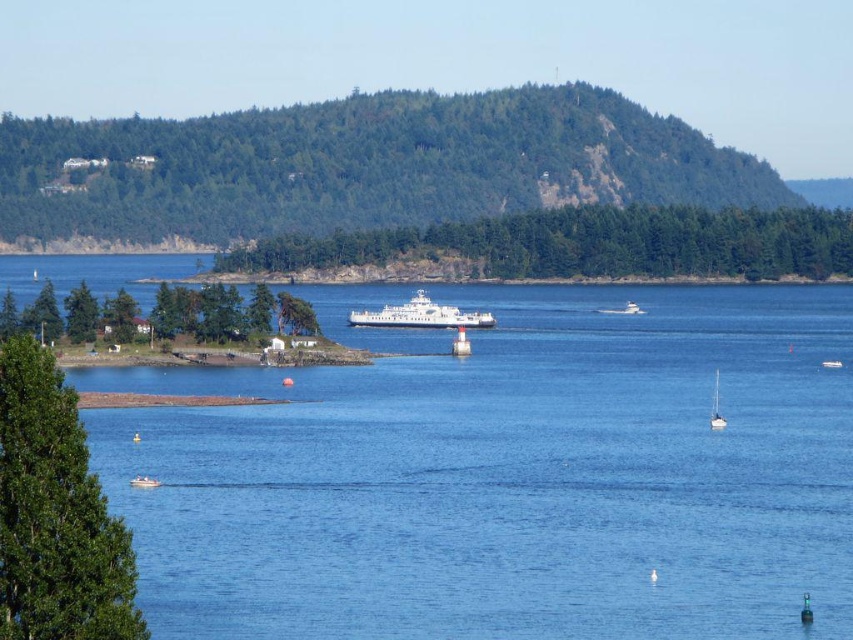
Question: Does white glossy ferry at center have a lesser width compared to white glossy sailboat at lower right?

Choices:
 (A) no
 (B) yes

Answer: (A)

Question: Among these objects, which one is farthest from the camera?

Choices:
 (A) white matte boat at center
 (B) blue water at center

Answer: (A)

Question: Can you confirm if white plastic boat at lower left is wider than white matte boat at center?

Choices:
 (A) no
 (B) yes

Answer: (A)

Question: Which point is farther from the camera taking this photo?

Choices:
 (A) (714, 380)
 (B) (149, 486)

Answer: (A)

Question: Among these objects, which one is farthest from the camera?

Choices:
 (A) white plastic boat at center
 (B) blue water at center
 (C) white matte boat at center
 (D) white glossy sailboat at lower right

Answer: (A)

Question: Can you confirm if white glossy sailboat at lower right is bigger than white plastic boat at lower left?

Choices:
 (A) yes
 (B) no

Answer: (A)